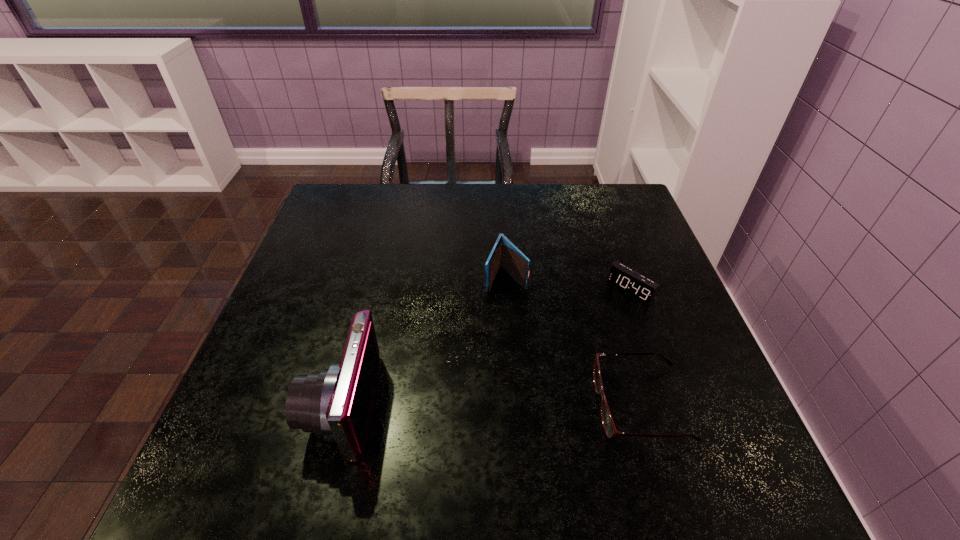
Locate an element on the screen. The height and width of the screenshot is (540, 960). object located in the left edge section of the desktop is located at coordinates (335, 403).

Identify the location of spectacles that is at the right edge. (607, 420).

The width and height of the screenshot is (960, 540). I want to click on alarm clock that is at the right edge, so click(634, 284).

Locate an element on the screen. This screenshot has width=960, height=540. object at the near left corner is located at coordinates (335, 403).

Identify the location of object located in the near right corner section of the desktop. The image size is (960, 540). (607, 420).

You are a GUI agent. You are given a task and a screenshot of the screen. Output one action in this format:
    pyautogui.click(x=<x>, y=<y>)
    Task: Click on the free space at the far edge
    The width and height of the screenshot is (960, 540).
    Given the screenshot: What is the action you would take?
    pyautogui.click(x=447, y=197)

Locate an element on the screen. The width and height of the screenshot is (960, 540). free space at the near edge of the desktop is located at coordinates (437, 423).

The height and width of the screenshot is (540, 960). I want to click on vacant region at the left edge of the desktop, so click(284, 320).

Image resolution: width=960 pixels, height=540 pixels. In the image, there is a desktop. What are the coordinates of `free region at the right edge` in the screenshot? It's located at (593, 238).

Where is `free spot at the far left corner of the desktop`? free spot at the far left corner of the desktop is located at coordinates (374, 193).